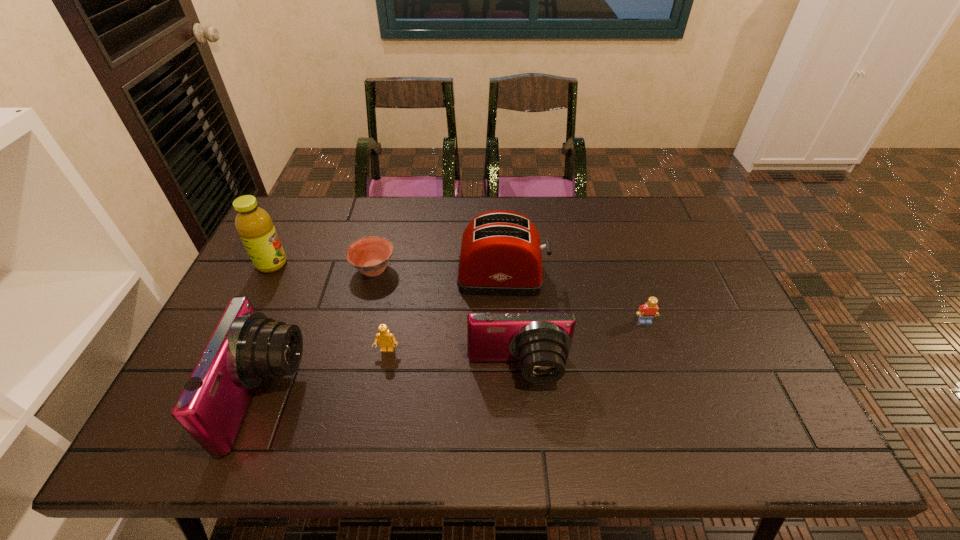
You are a GUI agent. You are given a task and a screenshot of the screen. Output one action in this format:
    pyautogui.click(x=<x>, y=<y>)
    Task: Click on the sixth object from right to left
    The width and height of the screenshot is (960, 540).
    Given the screenshot: What is the action you would take?
    pyautogui.click(x=246, y=348)

Where is `the left camera`? The width and height of the screenshot is (960, 540). the left camera is located at coordinates (246, 348).

Identify the location of the shorter camera. (540, 341).

Where is `the fourth tallest object`? the fourth tallest object is located at coordinates (540, 341).

You are a GUI agent. You are given a task and a screenshot of the screen. Output one action in this format:
    pyautogui.click(x=<x>, y=<y>)
    Task: Click on the shortest object
    This screenshot has width=960, height=540.
    Given the screenshot: What is the action you would take?
    pyautogui.click(x=370, y=255)

The width and height of the screenshot is (960, 540). I want to click on fruit juice, so click(254, 224).

The width and height of the screenshot is (960, 540). Identify the location of the tallest object. (254, 224).

Where is `the rightmost object`? The image size is (960, 540). the rightmost object is located at coordinates (648, 311).

I want to click on the right Lego, so click(x=648, y=311).

Find the location of a particular element. toaster is located at coordinates (500, 255).